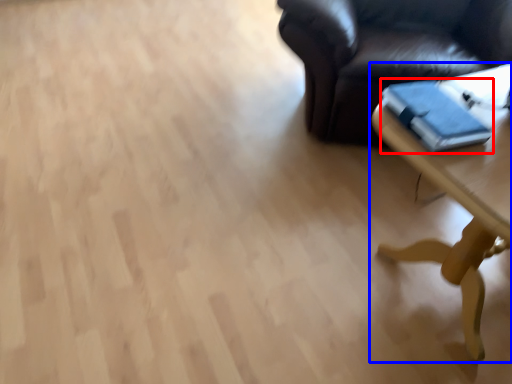
Question: Which of the following is the closest to the observer, book (highlighted by a red box) or table (highlighted by a blue box)?

Choices:
 (A) book
 (B) table

Answer: (B)